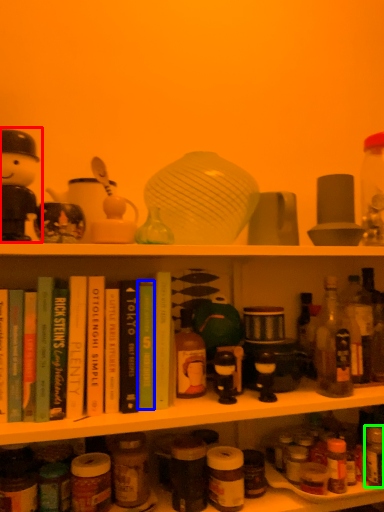
Question: Estimate the real-world distances between objects in this image. Which object is closer to toy (highlighted by a red box), book (highlighted by a blue box) or bottle (highlighted by a green box)?

Choices:
 (A) book
 (B) bottle

Answer: (A)